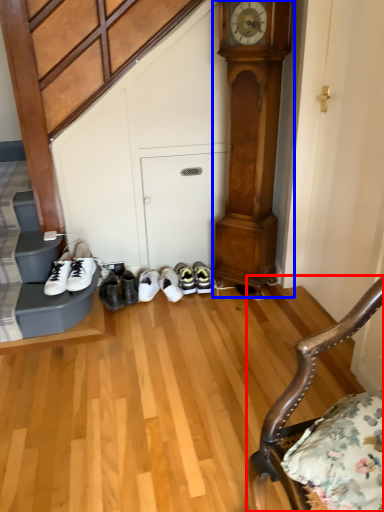
Question: Among these objects, which one is nearest to the camera, chair (highlighted by a red box) or clock (highlighted by a blue box)?

Choices:
 (A) chair
 (B) clock

Answer: (A)